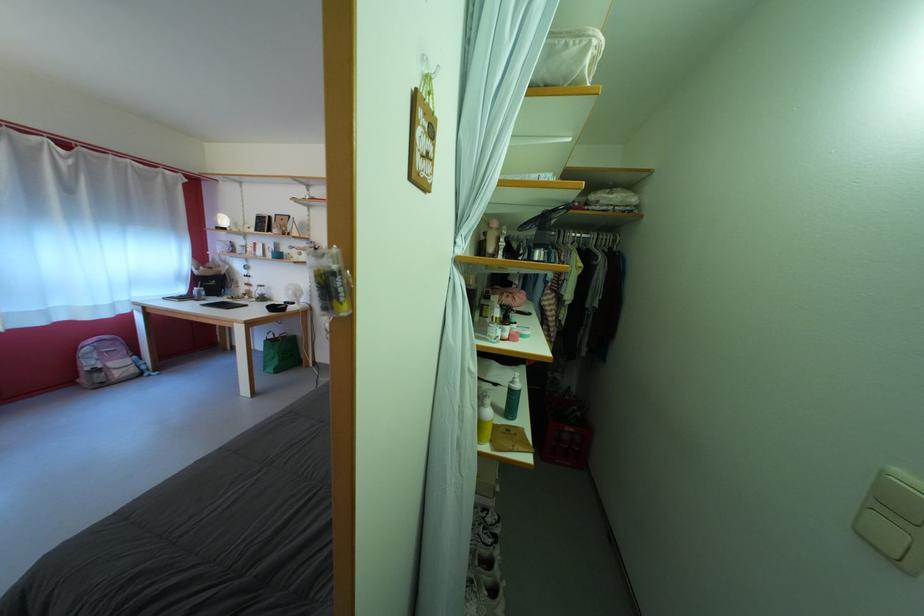
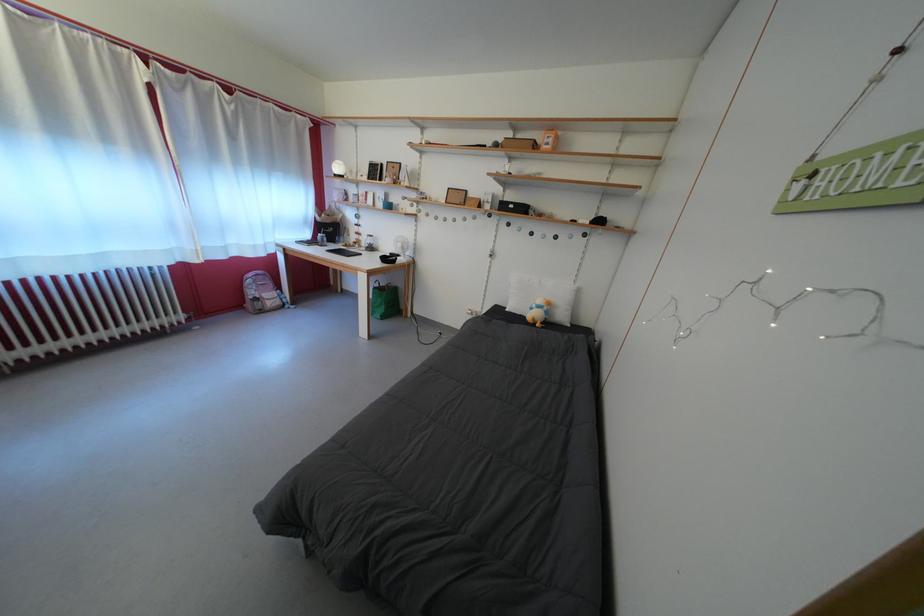
Where in the second image is the point corresponding to (x=99, y=370) from the first image?

(261, 299)